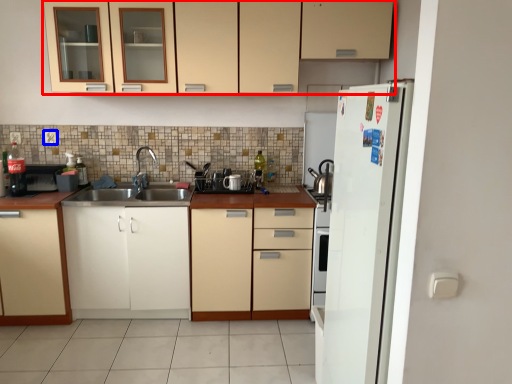
Question: Among these objects, which one is farthest to the camera, cabinetry (highlighted by a red box) or electric outlet (highlighted by a blue box)?

Choices:
 (A) cabinetry
 (B) electric outlet

Answer: (B)